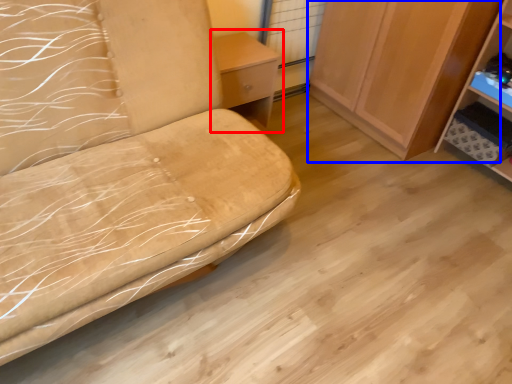
Question: Which point is closer to the camera, table (highlighted by a red box) or cabinetry (highlighted by a blue box)?

Choices:
 (A) table
 (B) cabinetry

Answer: (B)